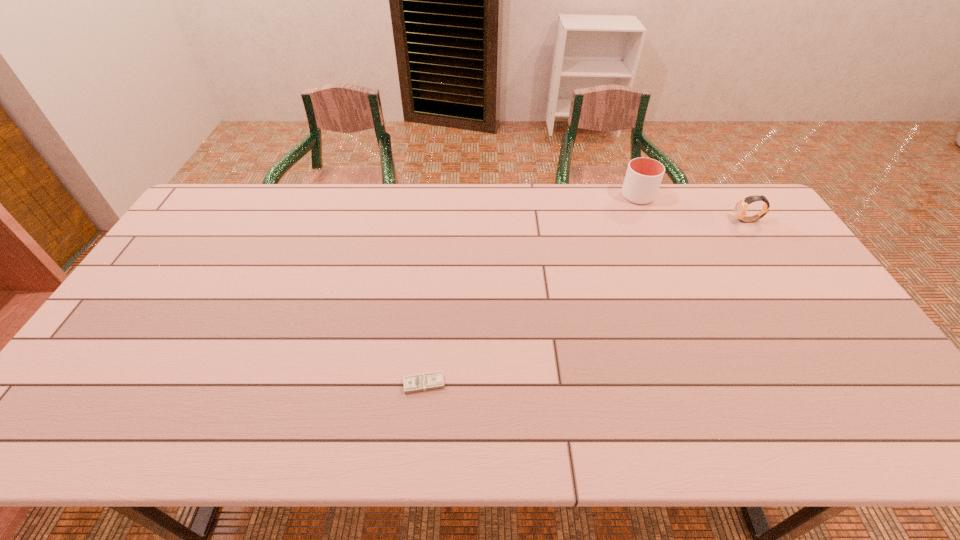
Identify the location of object that is the closest to the tallest object. The width and height of the screenshot is (960, 540). (741, 206).

This screenshot has width=960, height=540. Find the location of `vacant space that satisfies the following two spatial constraints: 1. on the face of the second farthest object; 2. on the front side of the nearest object`. vacant space that satisfies the following two spatial constraints: 1. on the face of the second farthest object; 2. on the front side of the nearest object is located at coordinates (856, 383).

The image size is (960, 540). Find the location of `blank space that satisfies the following two spatial constraints: 1. on the face of the rightmost object; 2. on the front side of the money`. blank space that satisfies the following two spatial constraints: 1. on the face of the rightmost object; 2. on the front side of the money is located at coordinates (856, 383).